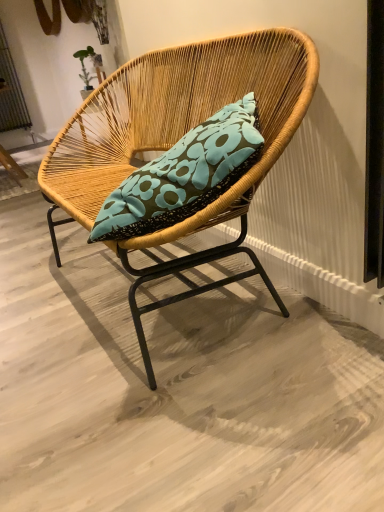
The height and width of the screenshot is (512, 384). In order to click on natural woven chair at center in this screenshot , I will do `click(176, 140)`.

What do you see at coordinates (176, 140) in the screenshot?
I see `natural woven chair at center` at bounding box center [176, 140].

At what (x,y) coordinates should I click in order to perform the action: click on metallic silver screen door at upper left. Please return your answer as a coordinate pair (x, y). Looking at the image, I should click on (11, 92).

What do you see at coordinates (11, 92) in the screenshot?
I see `metallic silver screen door at upper left` at bounding box center [11, 92].

Image resolution: width=384 pixels, height=512 pixels. I want to click on natural woven chair at center, so click(176, 140).

Which is more to the left, natural woven chair at center or metallic silver screen door at upper left?

Positioned to the left is metallic silver screen door at upper left.

Which object is closer to the camera, natural woven chair at center or metallic silver screen door at upper left?

natural woven chair at center is closer to the camera.

Is point (91, 133) in front of point (1, 31)?

That is True.

From the image's perspective, is natural woven chair at center on top of metallic silver screen door at upper left?

No.

From a real-world perspective, does natural woven chair at center stand above metallic silver screen door at upper left?

No, from a real-world perspective, natural woven chair at center is not over metallic silver screen door at upper left

Considering the relative sizes of natural woven chair at center and metallic silver screen door at upper left in the image provided, is natural woven chair at center thinner than metallic silver screen door at upper left?

In fact, natural woven chair at center might be wider than metallic silver screen door at upper left.

Considering the sizes of objects natural woven chair at center and metallic silver screen door at upper left in the image provided, who is shorter, natural woven chair at center or metallic silver screen door at upper left?

Standing shorter between the two is natural woven chair at center.

Does natural woven chair at center have a smaller size compared to metallic silver screen door at upper left?

No.

Is natural woven chair at center inside the boundaries of metallic silver screen door at upper left, or outside?

natural woven chair at center is located beyond the bounds of metallic silver screen door at upper left.

Is natural woven chair at center not close to metallic silver screen door at upper left?

Yes.

Could you tell me if natural woven chair at center is facing metallic silver screen door at upper left?

No, natural woven chair at center does not turn towards metallic silver screen door at upper left.

I want to click on chair on the right of metallic silver screen door at upper left, so click(x=176, y=140).

Does metallic silver screen door at upper left appear on the right side of natural woven chair at center?

Incorrect, metallic silver screen door at upper left is not on the right side of natural woven chair at center.

Is the position of metallic silver screen door at upper left more distant than that of natural woven chair at center?

Yes.

Does point (11, 63) come farther from viewer compared to point (226, 47)?

Yes, it is.

From the image's perspective, relative to natural woven chair at center, is metallic silver screen door at upper left above or below?

From the image's perspective, metallic silver screen door at upper left appears above natural woven chair at center.

From a real-world perspective, is metallic silver screen door at upper left physically located above or below natural woven chair at center?

In terms of real-world spatial position, metallic silver screen door at upper left is above natural woven chair at center.

Between metallic silver screen door at upper left and natural woven chair at center, which one has larger width?

Wider between the two is natural woven chair at center.

Is metallic silver screen door at upper left taller than natural woven chair at center?

Yes, metallic silver screen door at upper left is taller than natural woven chair at center.

In terms of size, does metallic silver screen door at upper left appear bigger or smaller than natural woven chair at center?

In the image, metallic silver screen door at upper left appears to be smaller than natural woven chair at center.

Is metallic silver screen door at upper left completely or partially outside of natural woven chair at center?

Absolutely, metallic silver screen door at upper left is external to natural woven chair at center.

Is metallic silver screen door at upper left touching natural woven chair at center?

metallic silver screen door at upper left and natural woven chair at center are clearly separated.

Is metallic silver screen door at upper left oriented away from natural woven chair at center?

No, metallic silver screen door at upper left is not facing away from natural woven chair at center.

The image size is (384, 512). Find the location of `chair directly beneath the metallic silver screen door at upper left (from a real-world perspective)`. chair directly beneath the metallic silver screen door at upper left (from a real-world perspective) is located at coordinates (176, 140).

This screenshot has height=512, width=384. Find the location of `screen door lying above the natural woven chair at center (from the image's perspective)`. screen door lying above the natural woven chair at center (from the image's perspective) is located at coordinates (11, 92).

The width and height of the screenshot is (384, 512). What are the coordinates of `screen door located above the natural woven chair at center (from a real-world perspective)` in the screenshot? It's located at (11, 92).